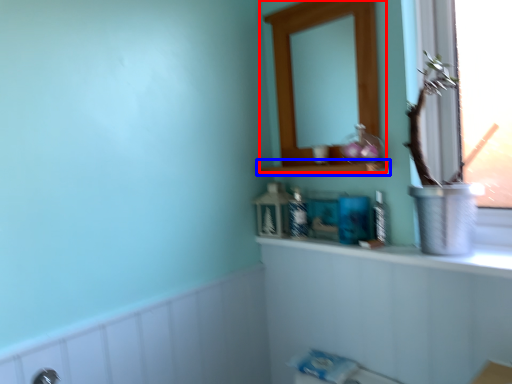
Question: Among these objects, which one is nearest to the camera, medicine cabinet (highlighted by a red box) or shelf (highlighted by a blue box)?

Choices:
 (A) medicine cabinet
 (B) shelf

Answer: (B)